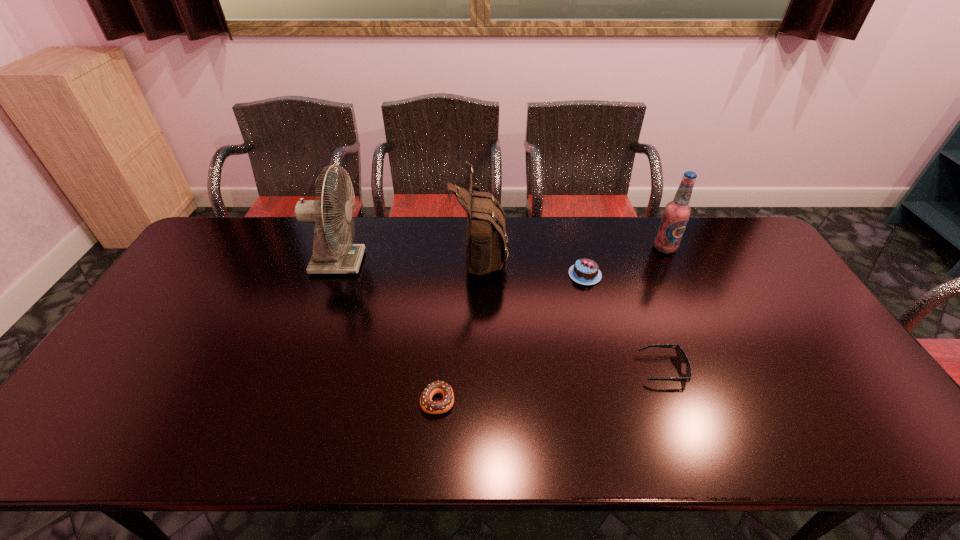
Locate an element on the screen. This screenshot has width=960, height=540. blank space located on the left of the fourth shortest object is located at coordinates (603, 248).

This screenshot has height=540, width=960. I want to click on vacant space located on the front of the fourth object from left to right, so click(x=613, y=387).

Find the location of `vacant space located on the front-facing side of the fifth object from left to right`. vacant space located on the front-facing side of the fifth object from left to right is located at coordinates (590, 369).

Where is `free space located on the front-facing side of the fifth object from left to right`? free space located on the front-facing side of the fifth object from left to right is located at coordinates (524, 369).

The image size is (960, 540). I want to click on free space located 0.400m on the front-facing side of the fifth object from left to right, so click(486, 369).

The width and height of the screenshot is (960, 540). I want to click on free point located 0.180m on the right of the doughnut, so click(x=529, y=401).

Identify the location of fan located at the far edge. The image size is (960, 540). (329, 257).

Locate an element on the screen. shoulder bag present at the far edge is located at coordinates (486, 244).

Locate an element on the screen. This screenshot has width=960, height=540. alcohol at the far edge is located at coordinates (676, 214).

The height and width of the screenshot is (540, 960). In the image, there is a desktop. Find the location of `vacant space at the far edge`. vacant space at the far edge is located at coordinates (521, 242).